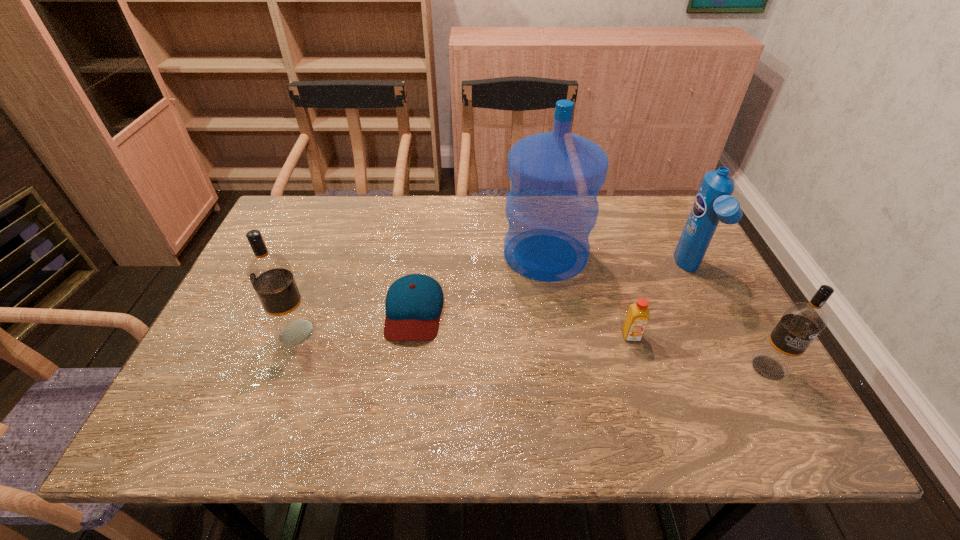
Identify the location of free space for an extra vodka to achieve even spacing. (524, 349).